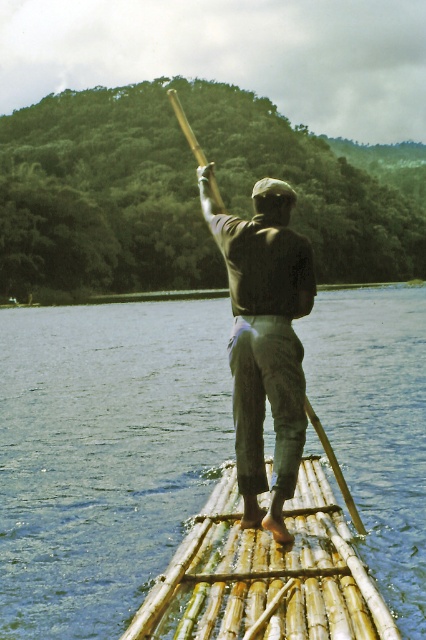
Can you confirm if blue water at center is thinner than wooden paddle at center?

Incorrect, blue water at center's width is not less than wooden paddle at center's.

Is blue water at center smaller than wooden paddle at center?

Actually, blue water at center might be larger than wooden paddle at center.

Is point (199, 353) less distant than point (345, 499)?

No, it is not.

You are a GUI agent. You are given a task and a screenshot of the screen. Output one action in this format:
    pyautogui.click(x=<x>, y=<y>)
    Task: Click on the blue water at center
    
    Given the screenshot: What is the action you would take?
    pyautogui.click(x=103, y=454)

Does blue water at center appear on the right side of bamboo raft at center?

Incorrect, blue water at center is not on the right side of bamboo raft at center.

Where is `blue water at center`? This screenshot has height=640, width=426. blue water at center is located at coordinates (103, 454).

Is point (198, 429) closer to viewer compared to point (249, 368)?

That is False.

Who is more forward, (187, 416) or (278, 465)?

Point (278, 465)

Identify the location of blue water at center. This screenshot has height=640, width=426. (103, 454).